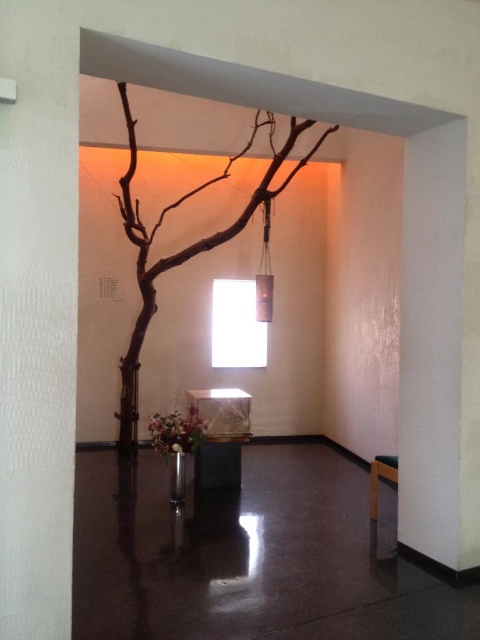
You are standing in the minimalist interior space and want to place a small statue exactly at the center of the room. The brown matte tree at center is currently located at point (187, 246). Is the statue placement at the center correct?

The brown matte tree at center is located at point (187, 246), which indicates that placing the statue at this coordinate would indeed be at the center of the room.

Based on the photo, you are an interior designer planning to place a rectangular decorative object between the white glossy vase at center and the wooden bench at lower right. The object must fit within the space between them. If the decorative object is 0.8 meters wide, will it fit based on the width comparison provided?

The white glossy vase at center is wider than the wooden bench at lower right. Since the decorative object is 0.8 meters wide, it must be narrower than the narrower object to fit. The wooden bench at lower right is narrower, so if the bench is narrower than 0.8 meters, the object won

Consider the image. You are designing a layout for a new art installation and need to place a large sculpture that requires 3 meters of space. You observe the brown matte tree at center and the wooden bench at lower right in the image. Based on their widths, which object would you consider moving to accommodate the sculpture?

The brown matte tree at center might be wider than wooden bench at lower right, so moving the wooden bench at lower right would be more feasible since it is narrower.